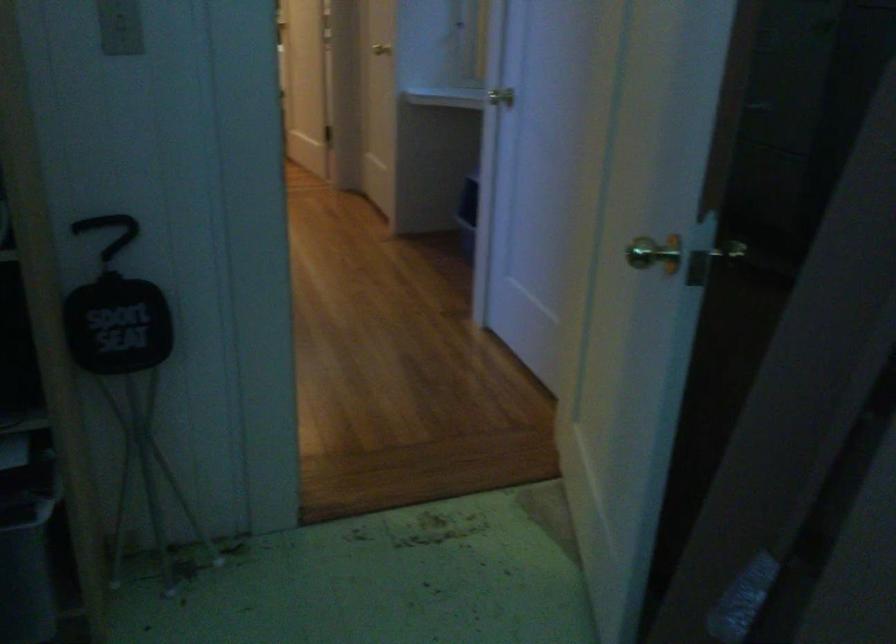
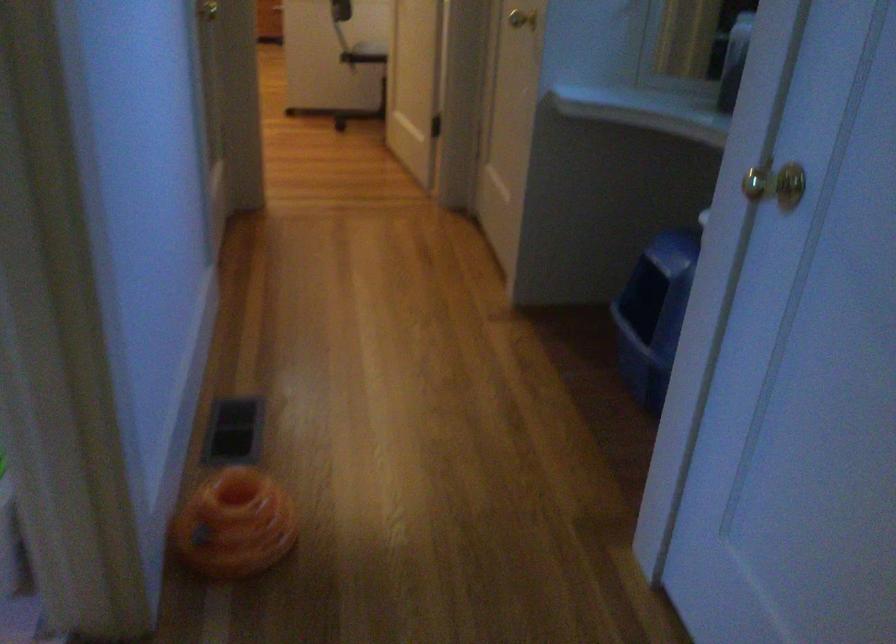
Where in the second image is the point corresponding to (504,88) from the first image?

(776, 184)